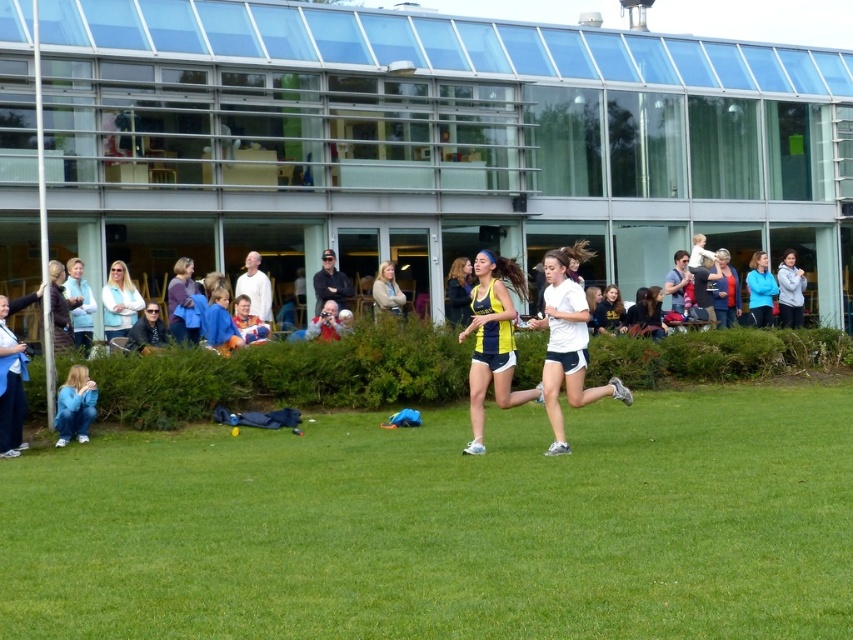
Question: Is yellow and blue athletic uniform at center above light brown leather jacket at center?

Choices:
 (A) yes
 (B) no

Answer: (B)

Question: Based on their relative distances, which object is farther from the yellow and blue athletic uniform at center?

Choices:
 (A) blue denim jeans at lower left
 (B) light blue sweater at center
 (C) white matte running shoes at center
 (D) yellow jersey at center

Answer: (D)

Question: Does white matte running shoes at center have a greater width compared to yellow and blue athletic uniform at center?

Choices:
 (A) no
 (B) yes

Answer: (A)

Question: In this image, where is yellow and blue athletic uniform at center located relative to light blue sweater at center?

Choices:
 (A) above
 (B) below

Answer: (B)

Question: Estimate the real-world distances between objects in this image. Which object is farther from the yellow jersey at center?

Choices:
 (A) blue denim jeans at lower left
 (B) yellow and blue athletic uniform at center

Answer: (B)

Question: Which point appears farthest from the camera in this image?

Choices:
 (A) (451, 308)
 (B) (753, 436)
 (C) (566, 358)

Answer: (A)